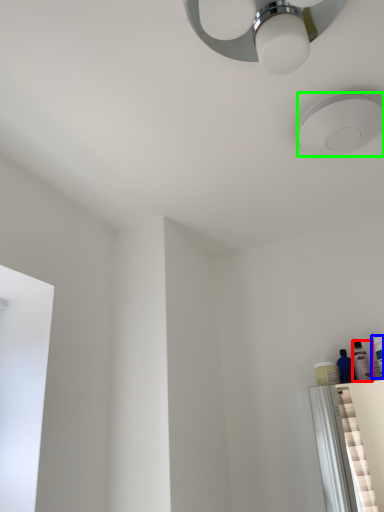
Question: Which object is positioned closest to toiletry (highlighted by a red box)? Select from toiletry (highlighted by a blue box) and droplight (highlighted by a green box).

Choices:
 (A) toiletry
 (B) droplight

Answer: (A)